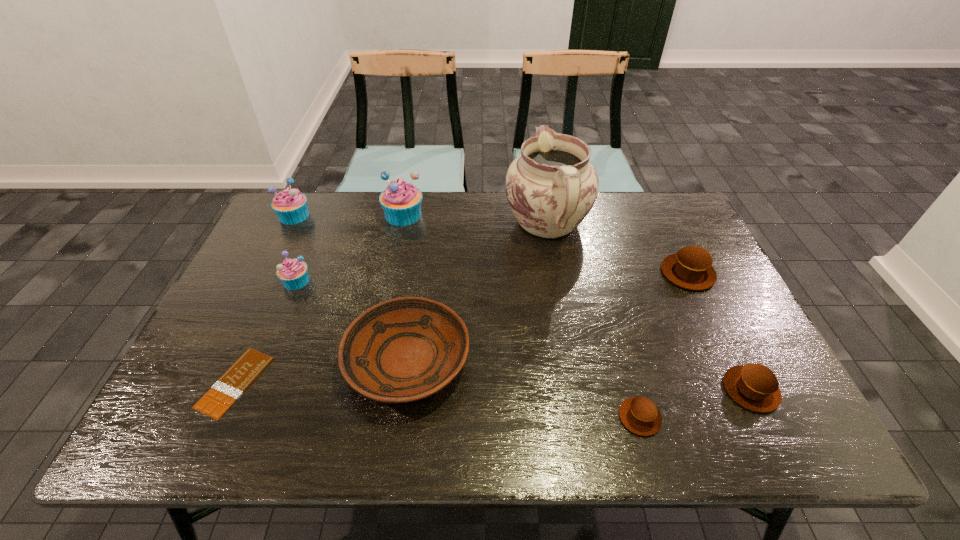
You are a GUI agent. You are given a task and a screenshot of the screen. Output one action in this format:
    pyautogui.click(x=<x>, y=<y>)
    Task: Click on the vacant space located 0.290m on the right of the chocolate bar
    The height and width of the screenshot is (540, 960).
    Given the screenshot: What is the action you would take?
    pyautogui.click(x=392, y=382)

The height and width of the screenshot is (540, 960). Identify the location of pitcher at the far edge. (551, 187).

I want to click on plate that is positioned at the near edge, so click(x=405, y=349).

This screenshot has height=540, width=960. What are the coordinates of `chocolate bar present at the near edge` in the screenshot? It's located at (227, 389).

You are a GUI agent. You are given a task and a screenshot of the screen. Output one action in this format:
    pyautogui.click(x=<x>, y=<y>)
    Task: Click on the chocolate bar present at the left edge
    
    Given the screenshot: What is the action you would take?
    pyautogui.click(x=227, y=389)

Where is `object that is at the far left corner`? Image resolution: width=960 pixels, height=540 pixels. object that is at the far left corner is located at coordinates (290, 205).

What are the coordinates of `object that is at the near left corner` in the screenshot? It's located at (227, 389).

Find the location of a particular element. The image size is (960, 540). object situated at the near right corner is located at coordinates (754, 386).

Locate an element on the screen. The height and width of the screenshot is (540, 960). free region at the far edge of the desktop is located at coordinates coord(448,215).

The height and width of the screenshot is (540, 960). I want to click on free point at the left edge, so click(271, 318).